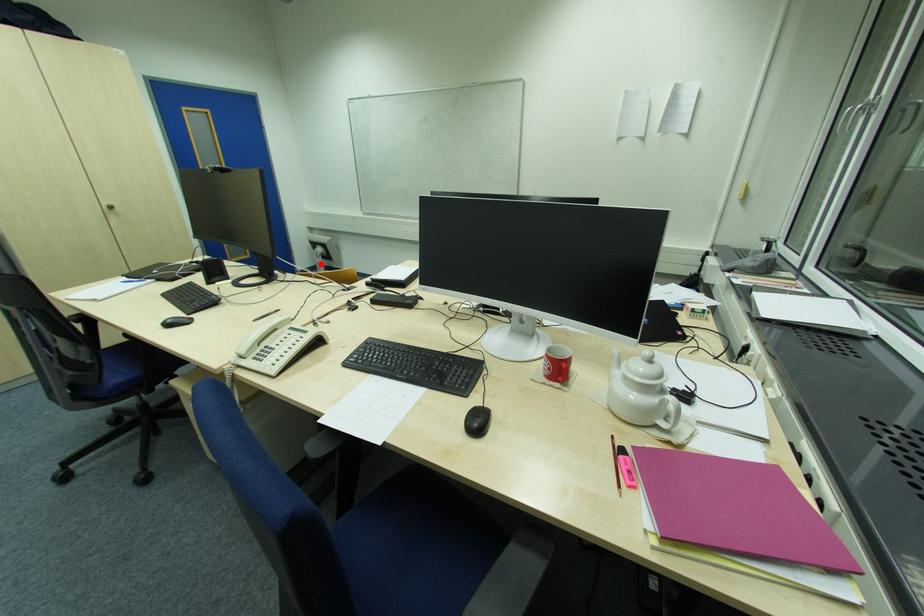
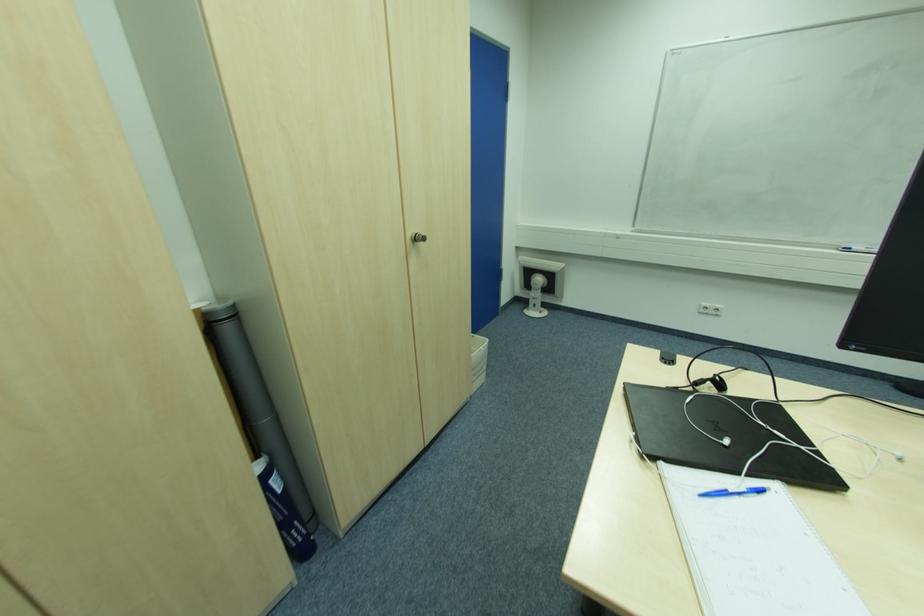
Question: I am providing you with two images of the same scene from different viewpoints. Given a red point in image1, look at the same physical point in image2. Is it:

Choices:
 (A) Closer to the viewpoint
 (B) Farther from the viewpoint

Answer: (A)